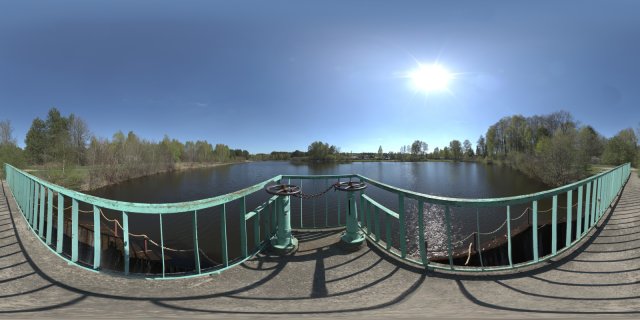
You are a GUI agent. You are given a task and a screenshot of the screen. Output one action in this format:
    pyautogui.click(x=<x>, y=<y>)
    Task: Click on the top of railing
    This screenshot has height=320, width=640.
    Given the screenshot: What is the action you would take?
    pyautogui.click(x=99, y=200)